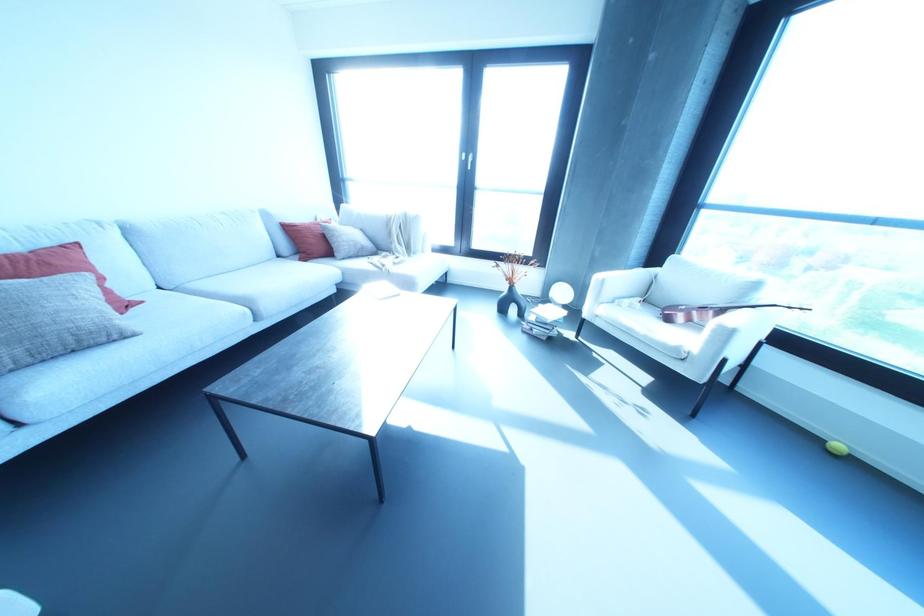
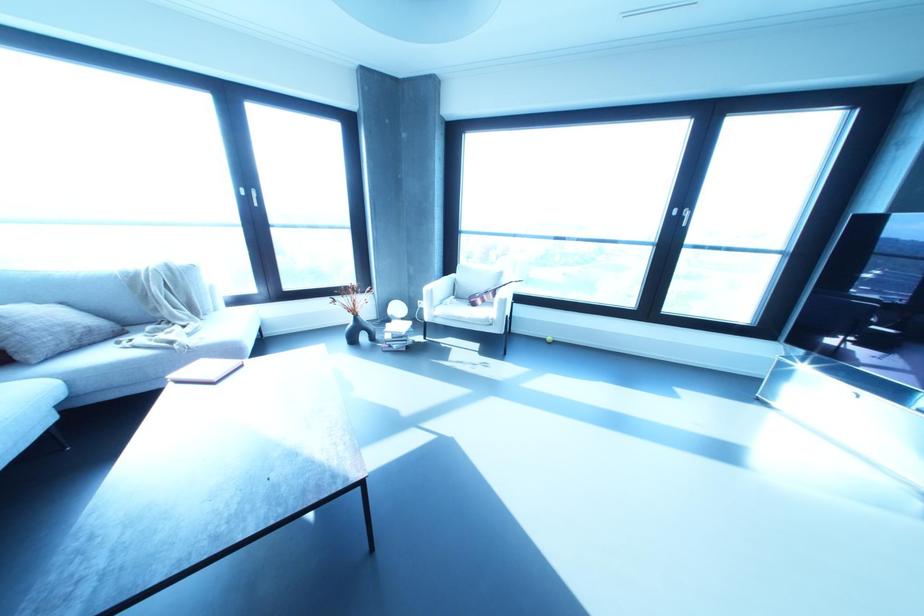
Where in the second image is the point corresponding to [397,294] from the first image?

(241, 365)